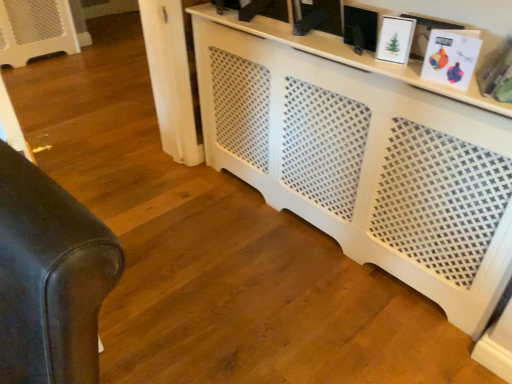
The width and height of the screenshot is (512, 384). Identify the location of free space to the left of matte black picture frame at upper center, which appears as the third picture frame when viewed from the right. (323, 46).